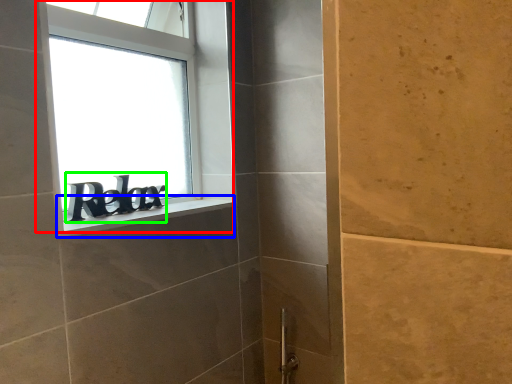
Question: Considering the real-world distances, which object is closest to window (highlighted by a red box)? window sill (highlighted by a blue box) or writing (highlighted by a green box).

Choices:
 (A) window sill
 (B) writing

Answer: (B)